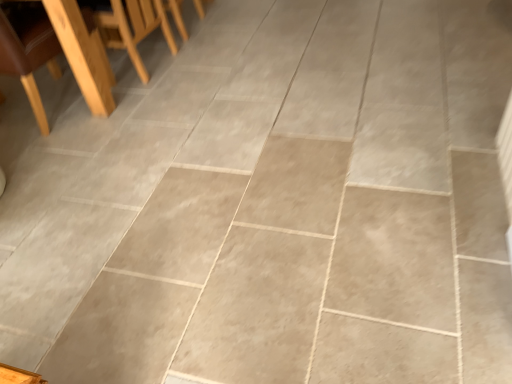
This screenshot has height=384, width=512. What do you see at coordinates (28, 50) in the screenshot?
I see `wooden chair at upper left` at bounding box center [28, 50].

Where is `wooden chair at upper left`? wooden chair at upper left is located at coordinates (28, 50).

Find the location of a particular element. wooden chair at upper left is located at coordinates (28, 50).